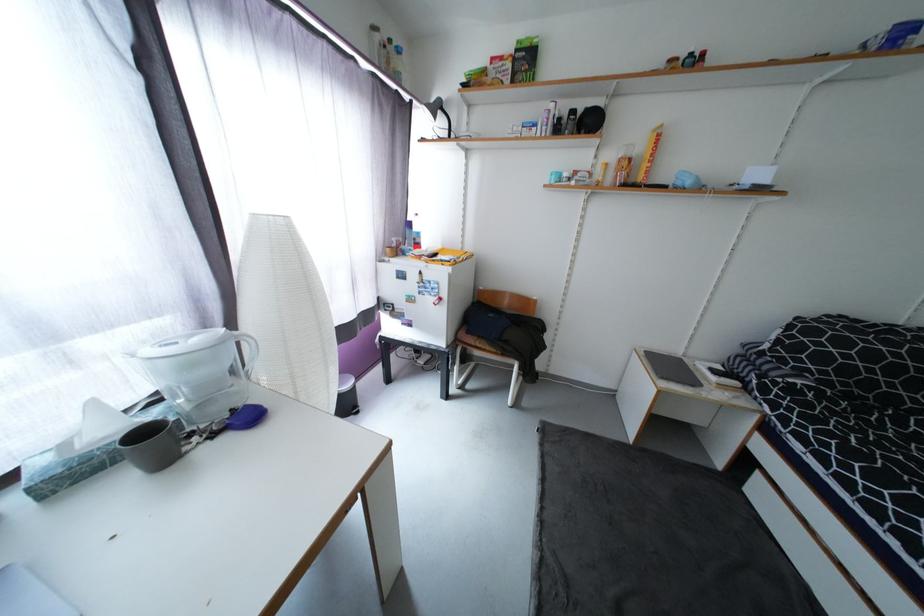
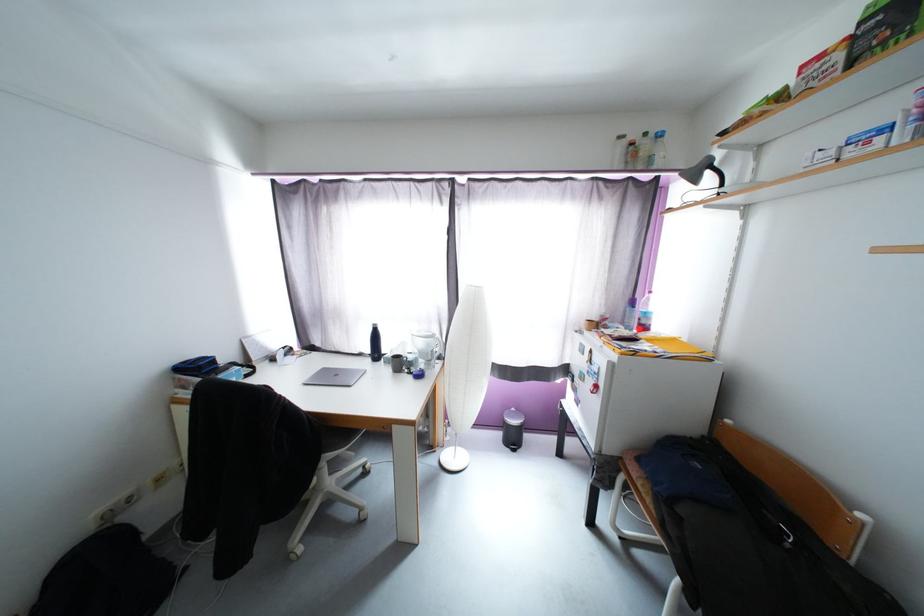
Question: The first image is from the beginning of the video and the second image is from the end. How did the camera likely rotate when shooting the video?

Choices:
 (A) Left
 (B) Right
 (C) Up
 (D) Down

Answer: (A)